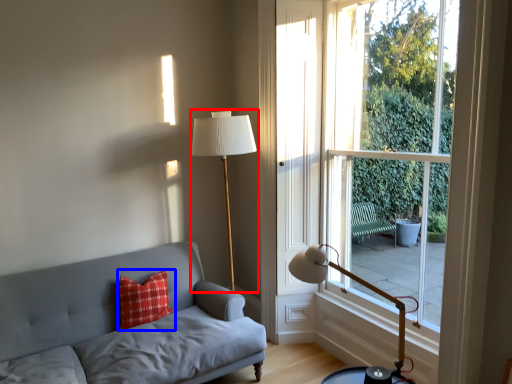
Question: Among these objects, which one is farthest to the camera, table lamp (highlighted by a red box) or pillow (highlighted by a blue box)?

Choices:
 (A) table lamp
 (B) pillow

Answer: (B)